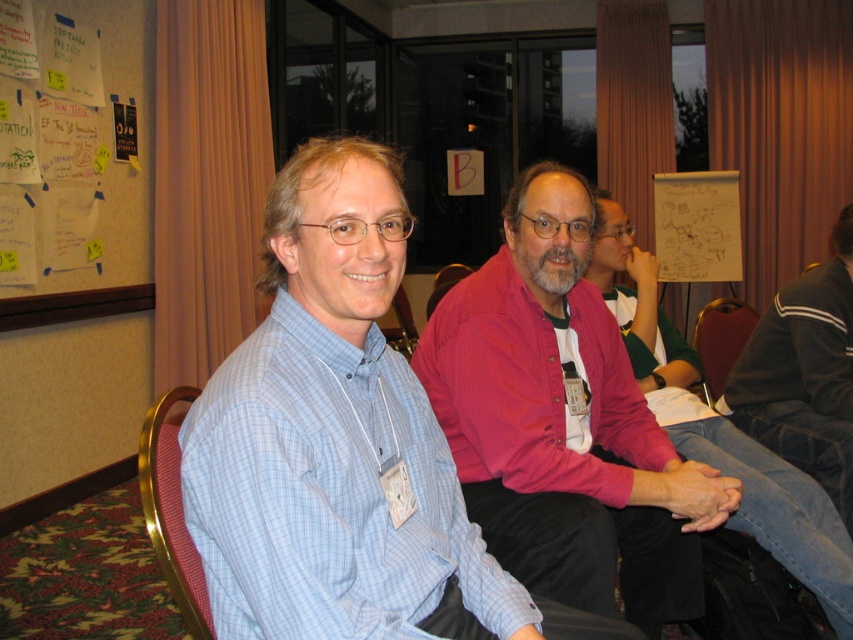
Does light blue checkered shirt at left appear on the left side of brown leather chair at center?

Indeed, light blue checkered shirt at left is positioned on the left side of brown leather chair at center.

Between light blue checkered shirt at left and brown leather chair at center, which one is positioned higher?

Positioned higher is brown leather chair at center.

Describe the element at coordinates (329, 493) in the screenshot. I see `light blue checkered shirt at left` at that location.

Where is `light blue checkered shirt at left`? The image size is (853, 640). light blue checkered shirt at left is located at coordinates (329, 493).

Looking at this image, is light blue checkered shirt at left bigger than red fabric chair at lower left?

Yes, light blue checkered shirt at left is bigger than red fabric chair at lower left.

Measure the distance from light blue checkered shirt at left to red fabric chair at lower left.

11.20 inches

Image resolution: width=853 pixels, height=640 pixels. In order to click on light blue checkered shirt at left in this screenshot , I will do `click(329, 493)`.

Find the location of a particular element. The width and height of the screenshot is (853, 640). light blue checkered shirt at left is located at coordinates (329, 493).

Is dark gray sweater at right above brown leather chair at center?

Correct, dark gray sweater at right is located above brown leather chair at center.

Who is more forward, (844, 356) or (735, 336)?

Point (844, 356)

The width and height of the screenshot is (853, 640). Identify the location of dark gray sweater at right. (804, 372).